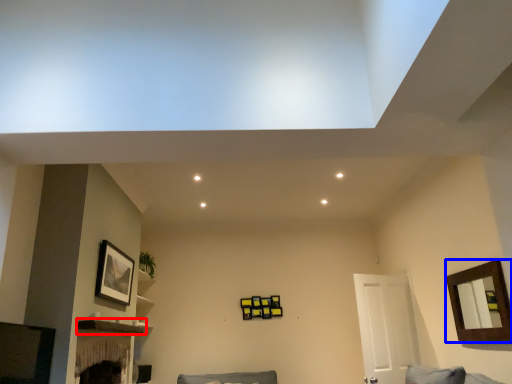
Question: Which object appears farthest to the camera in this image, shelf (highlighted by a red box) or picture frame (highlighted by a blue box)?

Choices:
 (A) shelf
 (B) picture frame

Answer: (A)